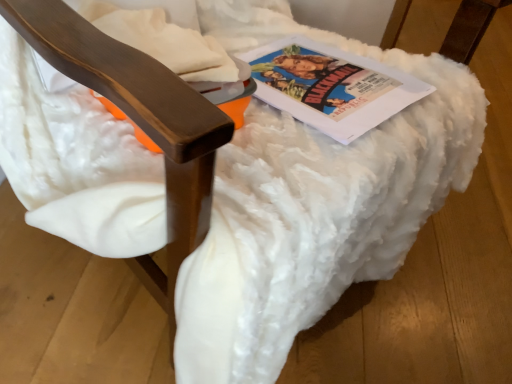
I want to click on free point above matte paper magazine at center (from a real-world perspective), so pos(351,84).